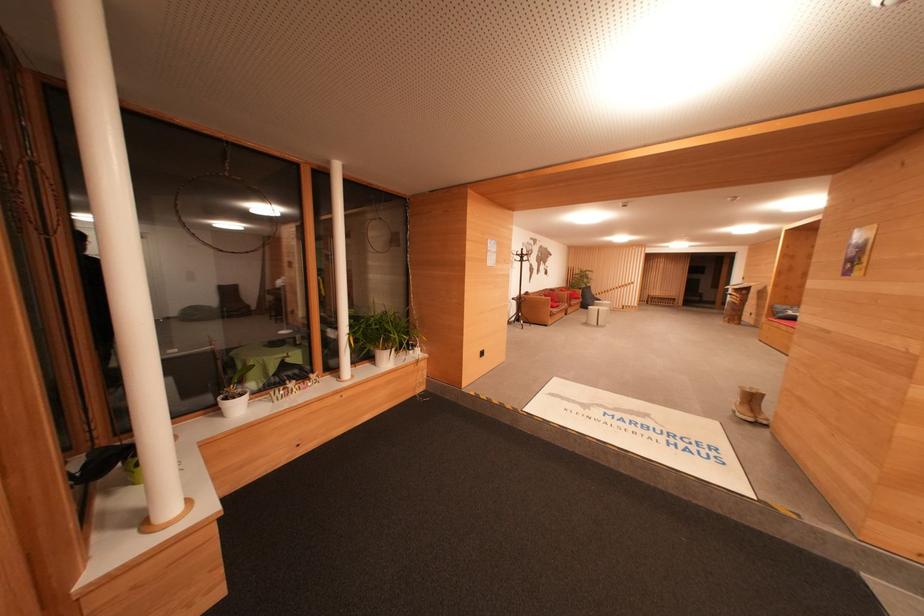
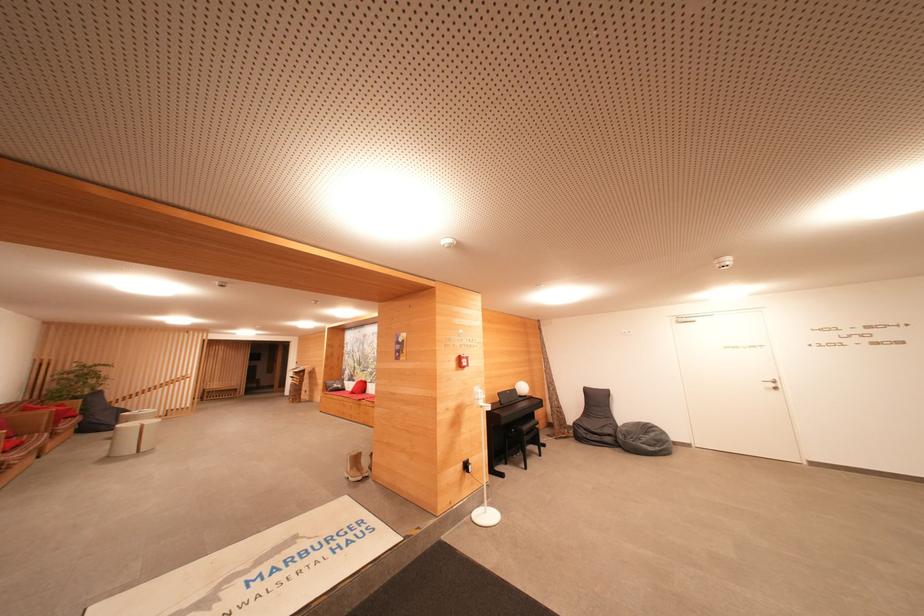
Find the pixel in the second image that matches point (756, 402) in the first image.

(359, 463)